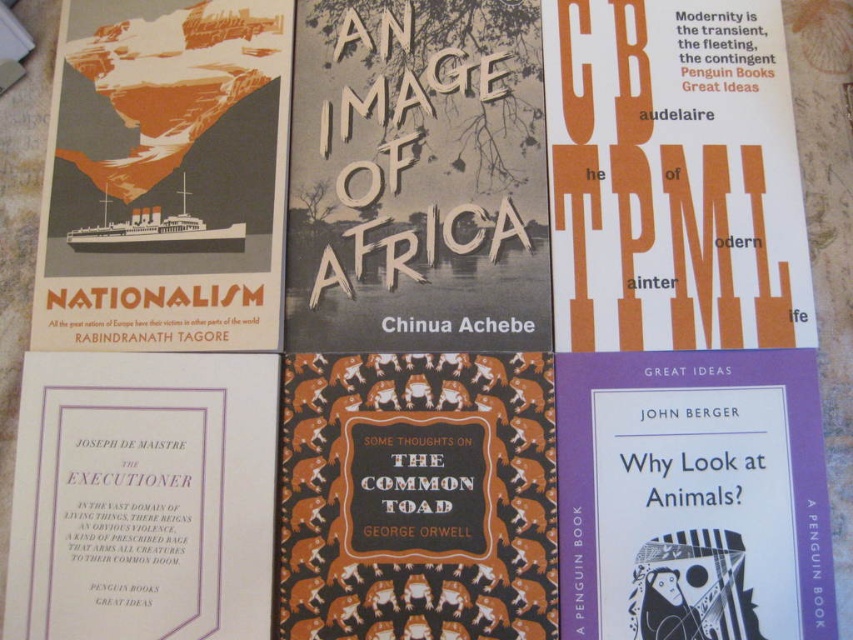
This screenshot has height=640, width=853. I want to click on brown textured paper at center, so click(416, 177).

Looking at this image, is brown textured paper at center below matte orange poster at upper left?

Yes.

You are a GUI agent. You are given a task and a screenshot of the screen. Output one action in this format:
    pyautogui.click(x=<x>, y=<y>)
    Task: Click on the brown textured paper at center
    The image size is (853, 640).
    Given the screenshot: What is the action you would take?
    pyautogui.click(x=416, y=177)

This screenshot has width=853, height=640. I want to click on brown textured paper at center, so click(x=416, y=177).

Which of these two, white paper at upper right or purple paper book at bottom left, stands taller?

white paper at upper right is taller.

Describe the element at coordinates (672, 177) in the screenshot. This screenshot has width=853, height=640. I see `white paper at upper right` at that location.

This screenshot has height=640, width=853. I want to click on white paper at upper right, so click(x=672, y=177).

Is purple paperback book at bottom right thinner than purple paper book at bottom left?

Incorrect, purple paperback book at bottom right's width is not less than purple paper book at bottom left's.

Who is lower down, purple paperback book at bottom right or purple paper book at bottom left?

Positioned lower is purple paperback book at bottom right.

This screenshot has height=640, width=853. Find the location of `purple paperback book at bottom right`. purple paperback book at bottom right is located at coordinates (692, 493).

Where is `purple paperback book at bottom right`? This screenshot has height=640, width=853. purple paperback book at bottom right is located at coordinates (692, 493).